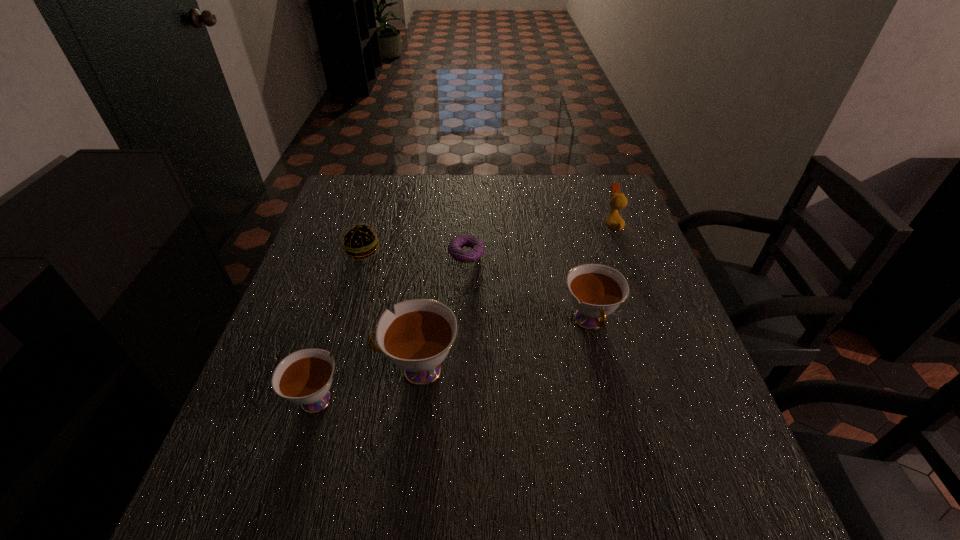
This screenshot has height=540, width=960. I want to click on the leftmost teacup, so click(304, 377).

In order to click on the second teacup from right to left in this screenshot , I will do `click(417, 339)`.

I want to click on the second tallest teacup, so click(x=596, y=290).

Identify the location of the rightmost teacup. This screenshot has width=960, height=540. (596, 290).

This screenshot has width=960, height=540. In order to click on the fifth tallest object in this screenshot , I will do `click(358, 241)`.

Find the location of a particular element. Image resolution: width=960 pixels, height=540 pixels. the rightmost object is located at coordinates tap(618, 201).

What are the coordinates of `the farthest object` in the screenshot? It's located at (618, 201).

Identify the location of the shortest object. (466, 256).

This screenshot has width=960, height=540. Find the location of `free region located on the side of the leftmost teacup with the handle`. free region located on the side of the leftmost teacup with the handle is located at coordinates (362, 250).

Find the location of a particular element. vacant space located 0.170m on the side of the leftmost teacup with the handle is located at coordinates (344, 310).